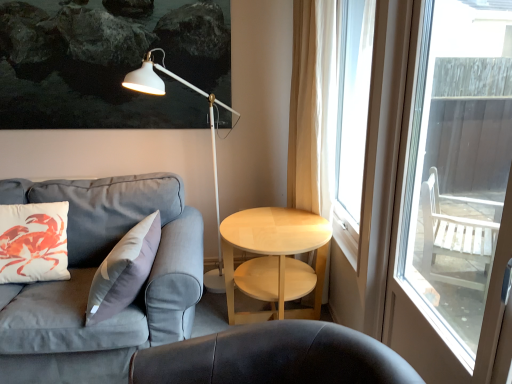
Locate an element on the screen. vacant point above white glossy table at right (from a real-world perspective) is located at coordinates (274, 228).